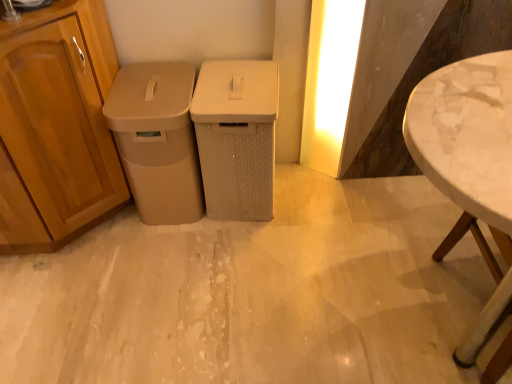
At what (x,y) coordinates should I click in order to perform the action: click on free space behind white marble table at right. Please return your answer as a coordinate pair (x, y). This screenshot has width=512, height=384. Looking at the image, I should click on (394, 217).